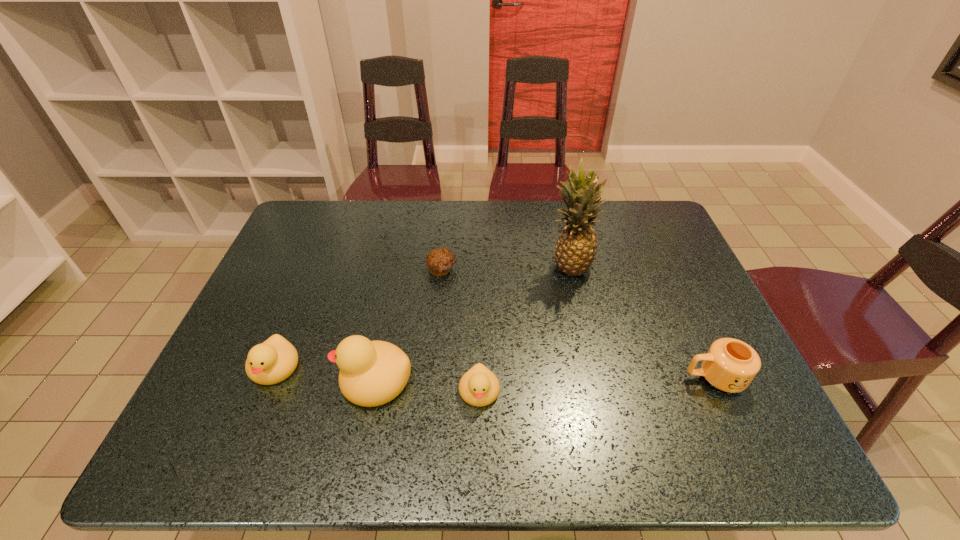
Locate an element on the screen. This screenshot has width=960, height=540. free location located 0.220m on the face of the tallest duckling is located at coordinates (241, 379).

This screenshot has width=960, height=540. I want to click on vacant space located 0.250m on the face of the tallest duckling, so [228, 379].

Identify the location of free space located 0.080m on the face of the tallest duckling. (301, 379).

The image size is (960, 540). Identify the location of vacant space situated on the front of the tallest object. (587, 347).

Where is `vacant space located on the left of the muffin`? vacant space located on the left of the muffin is located at coordinates (406, 270).

Where is `vacant space located on the handle side of the rightmost object`? The height and width of the screenshot is (540, 960). vacant space located on the handle side of the rightmost object is located at coordinates (584, 378).

You are a GUI agent. You are given a task and a screenshot of the screen. Output one action in this format:
    pyautogui.click(x=<x>, y=<y>)
    Task: Click on the free spot located 0.320m on the handle side of the rightmost object
    The image size is (960, 540).
    Given the screenshot: What is the action you would take?
    pyautogui.click(x=545, y=378)

Where is `free point located 0.260m on the handle side of the rightmost object`? The width and height of the screenshot is (960, 540). free point located 0.260m on the handle side of the rightmost object is located at coordinates (571, 378).

The height and width of the screenshot is (540, 960). Identify the location of mug located in the near edge section of the desktop. (730, 365).

You are a GUI agent. You are given a task and a screenshot of the screen. Output one action in this format:
    pyautogui.click(x=<x>, y=<y>)
    Task: Click on the object positioned at the left edge
    This screenshot has width=960, height=540.
    Given the screenshot: What is the action you would take?
    pyautogui.click(x=273, y=361)